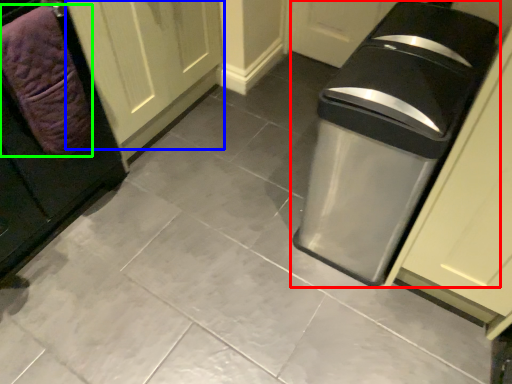
Question: Which is nearer to the waste container (highlighted by a red box)? door (highlighted by a blue box) or blanket (highlighted by a green box).

Choices:
 (A) door
 (B) blanket

Answer: (B)